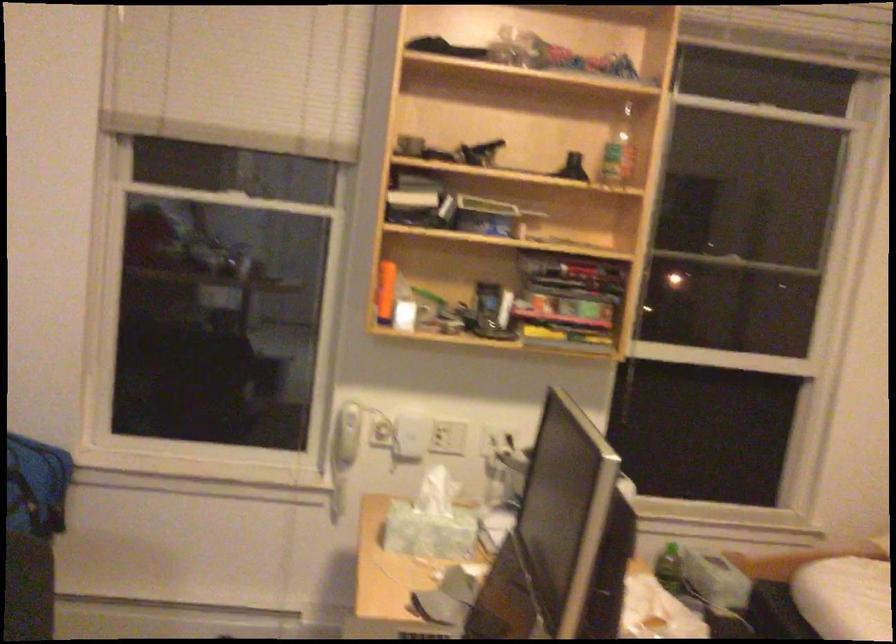
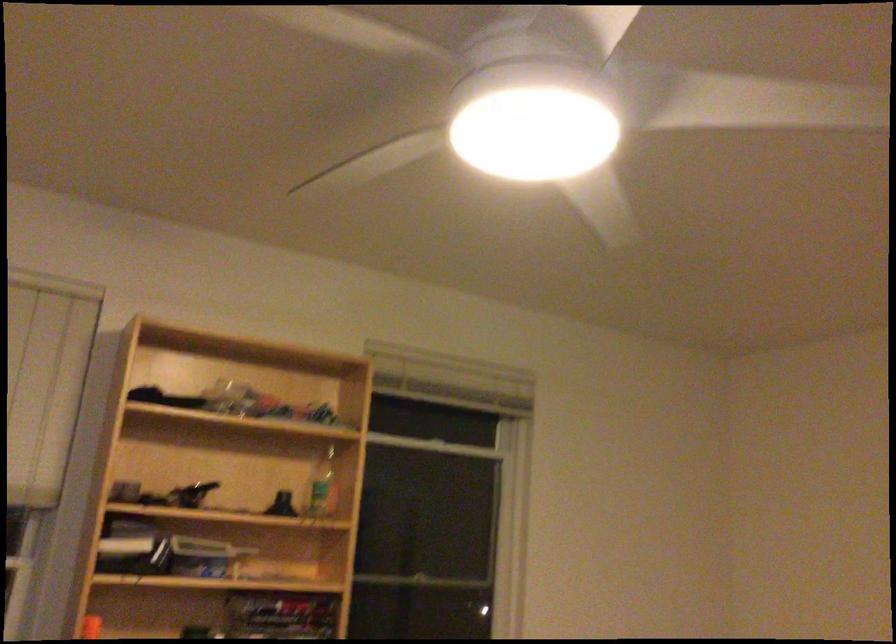
Find the pixel in the second image that matches (389,263) in the first image.

(90, 627)